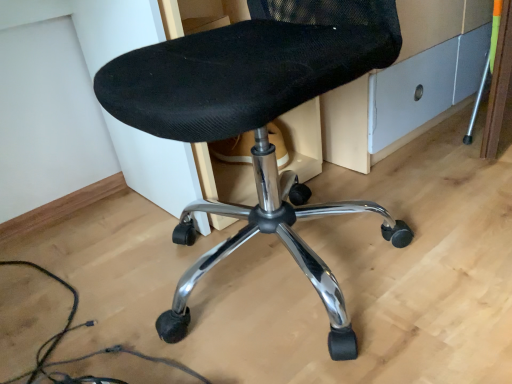
What is the approximate width of black mesh chair at center?

black mesh chair at center is 61.11 centimeters wide.

Describe the element at coordinates (257, 121) in the screenshot. The width and height of the screenshot is (512, 384). I see `black mesh chair at center` at that location.

What is the approximate height of black mesh chair at center?

It is 24.72 inches.

You are a GUI agent. You are given a task and a screenshot of the screen. Output one action in this format:
    pyautogui.click(x=<x>, y=<y>)
    Task: Click on the black mesh chair at center
    The width and height of the screenshot is (512, 384).
    Given the screenshot: What is the action you would take?
    pyautogui.click(x=257, y=121)

Image resolution: width=512 pixels, height=384 pixels. I want to click on black mesh chair at center, so click(257, 121).